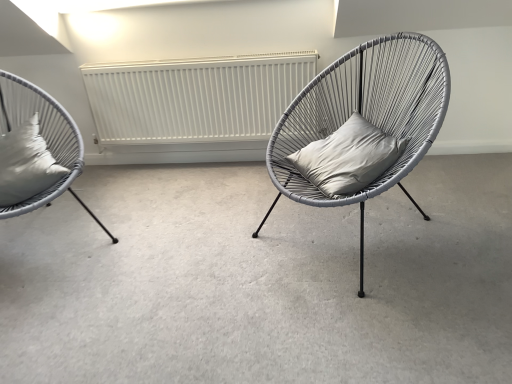
Question: From a real-world perspective, does matte gray wicker chair at center, the 1th chair in the right-to-left sequence, stand above matte gray wicker chair at left, which is counted as the first chair, starting from the left?

Choices:
 (A) no
 (B) yes

Answer: (A)

Question: Can you confirm if matte gray wicker chair at center, placed as the 2th chair when sorted from left to right, is shorter than matte gray wicker chair at left, which is the 2th chair from right to left?

Choices:
 (A) yes
 (B) no

Answer: (A)

Question: Is matte gray wicker chair at center, placed as the 2th chair when sorted from left to right, closer to the viewer compared to matte gray wicker chair at left, which is counted as the first chair, starting from the left?

Choices:
 (A) no
 (B) yes

Answer: (B)

Question: Is there a large distance between matte gray wicker chair at center, the 1th chair in the right-to-left sequence, and matte gray wicker chair at left, which is counted as the first chair, starting from the left?

Choices:
 (A) no
 (B) yes

Answer: (B)

Question: Does matte gray wicker chair at center, the 1th chair in the right-to-left sequence, have a larger size compared to matte gray wicker chair at left, which is counted as the first chair, starting from the left?

Choices:
 (A) yes
 (B) no

Answer: (A)

Question: Is satin white cushion at left, the second pillow positioned from the right, in front of or behind gray matte pillow at center, the second pillow from the left, in the image?

Choices:
 (A) front
 (B) behind

Answer: (B)

Question: From the image's perspective, is satin white cushion at left, the second pillow positioned from the right, above or below gray matte pillow at center, the second pillow from the left?

Choices:
 (A) below
 (B) above

Answer: (A)

Question: Considering the positions of satin white cushion at left, the second pillow positioned from the right, and gray matte pillow at center, the first pillow in the right-to-left sequence, in the image, is satin white cushion at left, the second pillow positioned from the right, bigger or smaller than gray matte pillow at center, the first pillow in the right-to-left sequence,?

Choices:
 (A) small
 (B) big

Answer: (B)

Question: Is satin white cushion at left, the second pillow positioned from the right, inside the boundaries of gray matte pillow at center, the second pillow from the left, or outside?

Choices:
 (A) inside
 (B) outside

Answer: (B)

Question: Considering the positions of gray matte cushion at center and satin white cushion at left, the second pillow positioned from the right, in the image, is gray matte cushion at center bigger or smaller than satin white cushion at left, the second pillow positioned from the right,?

Choices:
 (A) small
 (B) big

Answer: (B)

Question: Does point (421, 218) appear closer or farther from the camera than point (34, 120)?

Choices:
 (A) farther
 (B) closer

Answer: (A)

Question: Is gray matte cushion at center taller or shorter than satin white cushion at left, the first pillow viewed from the left?

Choices:
 (A) short
 (B) tall

Answer: (A)

Question: From a real-world perspective, is gray matte cushion at center positioned above or below satin white cushion at left, the second pillow positioned from the right?

Choices:
 (A) below
 (B) above

Answer: (A)

Question: Which is correct: matte gray wicker chair at center, placed as the 2th chair when sorted from left to right, is inside satin white cushion at left, the second pillow positioned from the right, or outside of it?

Choices:
 (A) inside
 (B) outside

Answer: (B)

Question: Considering the positions of point (339, 99) and point (10, 187), is point (339, 99) closer or farther from the camera than point (10, 187)?

Choices:
 (A) closer
 (B) farther

Answer: (B)